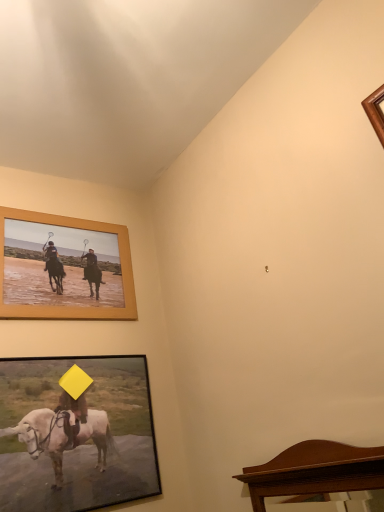
The width and height of the screenshot is (384, 512). Describe the element at coordinates (76, 435) in the screenshot. I see `wooden-framed picture at lower left, arranged as the second picture frame when viewed from the top` at that location.

At what (x,y) coordinates should I click in order to perform the action: click on wooden frame at upper left, which appears as the 1th picture frame when viewed from the top. Please return your answer as a coordinate pair (x, y). Looking at the image, I should click on (64, 268).

Considering the positions of objects wooden frame at upper left, which is the second picture frame in bottom-to-top order, and mahogany wood mirror at lower right in the image provided, who is more to the right, wooden frame at upper left, which is the second picture frame in bottom-to-top order, or mahogany wood mirror at lower right?

mahogany wood mirror at lower right.

From the image's perspective, does wooden frame at upper left, which appears as the 1th picture frame when viewed from the top, appear lower than mahogany wood mirror at lower right?

Actually, wooden frame at upper left, which appears as the 1th picture frame when viewed from the top, appears above mahogany wood mirror at lower right in the image.

Is wooden frame at upper left, which appears as the 1th picture frame when viewed from the top, positioned with its back to mahogany wood mirror at lower right?

No, wooden frame at upper left, which appears as the 1th picture frame when viewed from the top, is not facing the opposite direction of mahogany wood mirror at lower right.

Is mahogany wood mirror at lower right completely or partially inside wooden frame at upper left, which appears as the 1th picture frame when viewed from the top?

No, mahogany wood mirror at lower right is not a part of wooden frame at upper left, which appears as the 1th picture frame when viewed from the top.

Could you tell me if mahogany wood mirror at lower right is facing wooden-framed picture at lower left, arranged as the second picture frame when viewed from the top?

No, mahogany wood mirror at lower right does not turn towards wooden-framed picture at lower left, arranged as the second picture frame when viewed from the top.

Does mahogany wood mirror at lower right have a lesser height compared to wooden-framed picture at lower left, the first picture frame in the bottom-to-top sequence?

Yes, mahogany wood mirror at lower right is shorter than wooden-framed picture at lower left, the first picture frame in the bottom-to-top sequence.

Which is behind, point (371, 484) or point (43, 390)?

The point (43, 390) is more distant.

From the image's perspective, relative to wooden-framed picture at lower left, the first picture frame in the bottom-to-top sequence, is mahogany wood mirror at lower right above or below?

mahogany wood mirror at lower right is above wooden-framed picture at lower left, the first picture frame in the bottom-to-top sequence.

Locate an element on the screen. The height and width of the screenshot is (512, 384). picture frame behind the wooden-framed picture at lower left, arranged as the second picture frame when viewed from the top is located at coordinates (64, 268).

Which point is more distant from viewer, [2,279] or [62,439]?

Positioned behind is point [2,279].

Does wooden frame at upper left, which appears as the 1th picture frame when viewed from the top, have a greater width compared to wooden-framed picture at lower left, the first picture frame in the bottom-to-top sequence?

No, wooden frame at upper left, which appears as the 1th picture frame when viewed from the top, is not wider than wooden-framed picture at lower left, the first picture frame in the bottom-to-top sequence.

Could you measure the distance between wooden-framed picture at lower left, arranged as the second picture frame when viewed from the top, and mahogany wood mirror at lower right?

A distance of 19.54 inches exists between wooden-framed picture at lower left, arranged as the second picture frame when viewed from the top, and mahogany wood mirror at lower right.

Considering the relative positions of wooden-framed picture at lower left, arranged as the second picture frame when viewed from the top, and mahogany wood mirror at lower right in the image provided, is wooden-framed picture at lower left, arranged as the second picture frame when viewed from the top, to the right of mahogany wood mirror at lower right from the viewer's perspective?

No.

Locate an element on the screen. furniture above the wooden-framed picture at lower left, arranged as the second picture frame when viewed from the top (from the image's perspective) is located at coordinates (315, 471).

From a real-world perspective, who is located lower, wooden-framed picture at lower left, the first picture frame in the bottom-to-top sequence, or mahogany wood mirror at lower right?

mahogany wood mirror at lower right.

Can you tell me how much wooden-framed picture at lower left, arranged as the second picture frame when viewed from the top, and wooden frame at upper left, which appears as the 1th picture frame when viewed from the top, differ in facing direction?

There is a 0.725-degree angle between the facing directions of wooden-framed picture at lower left, arranged as the second picture frame when viewed from the top, and wooden frame at upper left, which appears as the 1th picture frame when viewed from the top.

Does wooden-framed picture at lower left, the first picture frame in the bottom-to-top sequence, turn towards wooden frame at upper left, which appears as the 1th picture frame when viewed from the top?

No, wooden-framed picture at lower left, the first picture frame in the bottom-to-top sequence, is not oriented towards wooden frame at upper left, which appears as the 1th picture frame when viewed from the top.

Find the location of `picture frame that is above the wooden-framed picture at lower left, arranged as the second picture frame when viewed from the top (from the image's perspective)`. picture frame that is above the wooden-framed picture at lower left, arranged as the second picture frame when viewed from the top (from the image's perspective) is located at coordinates (64, 268).

Considering the sizes of objects wooden-framed picture at lower left, arranged as the second picture frame when viewed from the top, and wooden frame at upper left, which appears as the 1th picture frame when viewed from the top, in the image provided, who is thinner, wooden-framed picture at lower left, arranged as the second picture frame when viewed from the top, or wooden frame at upper left, which appears as the 1th picture frame when viewed from the top,?

wooden frame at upper left, which appears as the 1th picture frame when viewed from the top, is thinner.

What's the angular difference between mahogany wood mirror at lower right and wooden frame at upper left, which is the second picture frame in bottom-to-top order,'s facing directions?

They differ by 88.7 degrees in their facing directions.

Looking at their sizes, would you say mahogany wood mirror at lower right is wider or thinner than wooden frame at upper left, which appears as the 1th picture frame when viewed from the top?

Clearly, mahogany wood mirror at lower right has more width compared to wooden frame at upper left, which appears as the 1th picture frame when viewed from the top.

Are mahogany wood mirror at lower right and wooden frame at upper left, which appears as the 1th picture frame when viewed from the top, beside each other?

No, mahogany wood mirror at lower right is not with wooden frame at upper left, which appears as the 1th picture frame when viewed from the top.

Which is in front, point (273, 462) or point (118, 264)?

The point (273, 462) is more forward.

Locate an element on the screen. furniture in front of the wooden frame at upper left, which appears as the 1th picture frame when viewed from the top is located at coordinates (315, 471).

Which picture frame is the 1st one when counting from the back of the mahogany wood mirror at lower right? Please provide its 2D coordinates.

[(76, 435)]

Looking at the image, which one is located further to wooden frame at upper left, which is the second picture frame in bottom-to-top order, mahogany wood mirror at lower right or wooden-framed picture at lower left, arranged as the second picture frame when viewed from the top?

mahogany wood mirror at lower right lies further to wooden frame at upper left, which is the second picture frame in bottom-to-top order, than the other object.

Estimate the real-world distances between objects in this image. Which object is further from wooden frame at upper left, which is the second picture frame in bottom-to-top order, wooden-framed picture at lower left, the first picture frame in the bottom-to-top sequence, or mahogany wood mirror at lower right?

The object further to wooden frame at upper left, which is the second picture frame in bottom-to-top order, is mahogany wood mirror at lower right.

When comparing their distances from mahogany wood mirror at lower right, does wooden-framed picture at lower left, the first picture frame in the bottom-to-top sequence, or wooden frame at upper left, which appears as the 1th picture frame when viewed from the top, seem further?

Based on the image, wooden frame at upper left, which appears as the 1th picture frame when viewed from the top, appears to be further to mahogany wood mirror at lower right.

Looking at the image, which one is located closer to wooden-framed picture at lower left, the first picture frame in the bottom-to-top sequence, mahogany wood mirror at lower right or wooden frame at upper left, which appears as the 1th picture frame when viewed from the top?

wooden frame at upper left, which appears as the 1th picture frame when viewed from the top.

Which object lies nearer to the anchor point mahogany wood mirror at lower right, wooden frame at upper left, which appears as the 1th picture frame when viewed from the top, or wooden-framed picture at lower left, the first picture frame in the bottom-to-top sequence?

The object closer to mahogany wood mirror at lower right is wooden-framed picture at lower left, the first picture frame in the bottom-to-top sequence.

From the image, which object appears to be farther from wooden-framed picture at lower left, the first picture frame in the bottom-to-top sequence, wooden frame at upper left, which appears as the 1th picture frame when viewed from the top, or mahogany wood mirror at lower right?

mahogany wood mirror at lower right.

Where is `picture frame located between wooden frame at upper left, which appears as the 1th picture frame when viewed from the top, and mahogany wood mirror at lower right in the left-right direction`? The height and width of the screenshot is (512, 384). picture frame located between wooden frame at upper left, which appears as the 1th picture frame when viewed from the top, and mahogany wood mirror at lower right in the left-right direction is located at coordinates (76, 435).